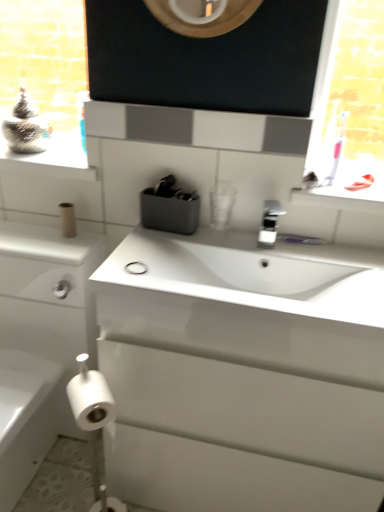
Find the location of `vacant region in front of brown cardboard toilet paper at lower left, acting as the 1th toilet paper starting from the back`. vacant region in front of brown cardboard toilet paper at lower left, acting as the 1th toilet paper starting from the back is located at coordinates (56, 248).